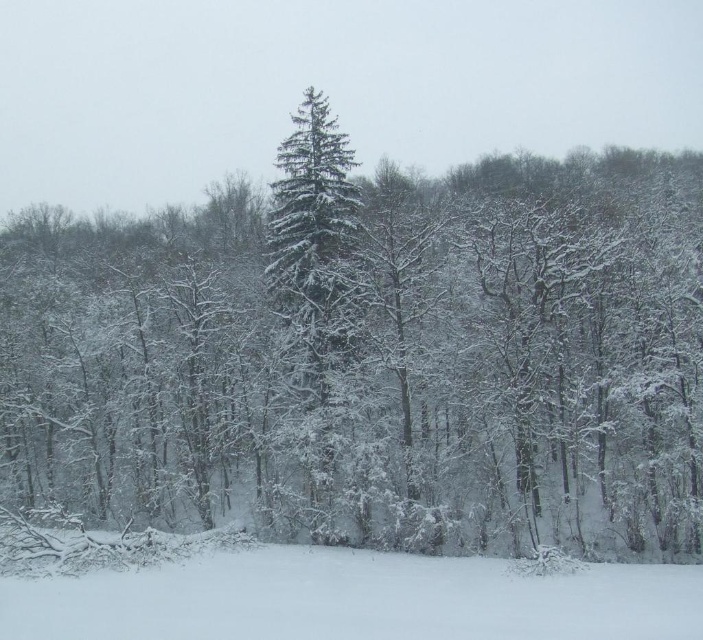
Question: Is white fluffy snow at lower center closer to the viewer compared to green matte evergreen tree at center?

Choices:
 (A) no
 (B) yes

Answer: (B)

Question: Which object appears closest to the camera in this image?

Choices:
 (A) white fluffy snow at lower center
 (B) green matte evergreen tree at center

Answer: (A)

Question: Which point appears farthest from the camera in this image?

Choices:
 (A) click(311, 433)
 (B) click(401, 620)

Answer: (A)

Question: Does white fluffy snow at lower center appear under green matte evergreen tree at center?

Choices:
 (A) no
 (B) yes

Answer: (B)

Question: Can you confirm if white fluffy snow at lower center is positioned below green matte evergreen tree at center?

Choices:
 (A) no
 (B) yes

Answer: (B)